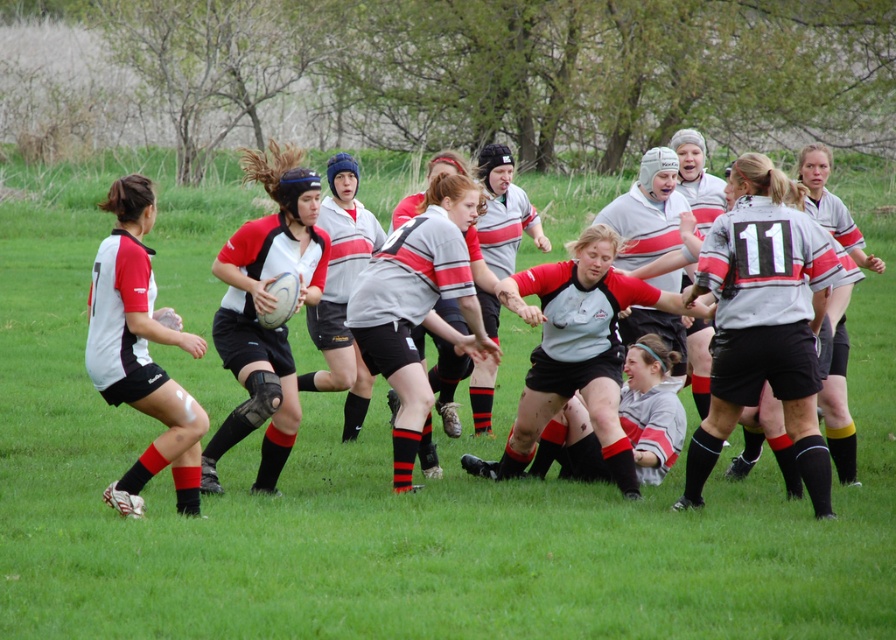
Question: From the image, what is the correct spatial relationship of matte black rugby ball at center in relation to matte black shorts at left?

Choices:
 (A) above
 (B) below

Answer: (A)

Question: Is matte black rugby ball at center positioned before gray matte rugby jersey at center?

Choices:
 (A) yes
 (B) no

Answer: (A)

Question: Which of the following is the closest to the observer?

Choices:
 (A) (112, 192)
 (B) (412, 376)
 (C) (326, 253)

Answer: (A)

Question: Which is nearer to the gray matte rugby jersey at center?

Choices:
 (A) matte black shorts at left
 (B) matte black rugby ball at center

Answer: (B)

Question: Which point is farther from the camera taking this photo?

Choices:
 (A) (472, 211)
 (B) (153, 474)

Answer: (A)

Question: Can you confirm if matte black rugby ball at center is wider than matte black shorts at left?

Choices:
 (A) yes
 (B) no

Answer: (B)